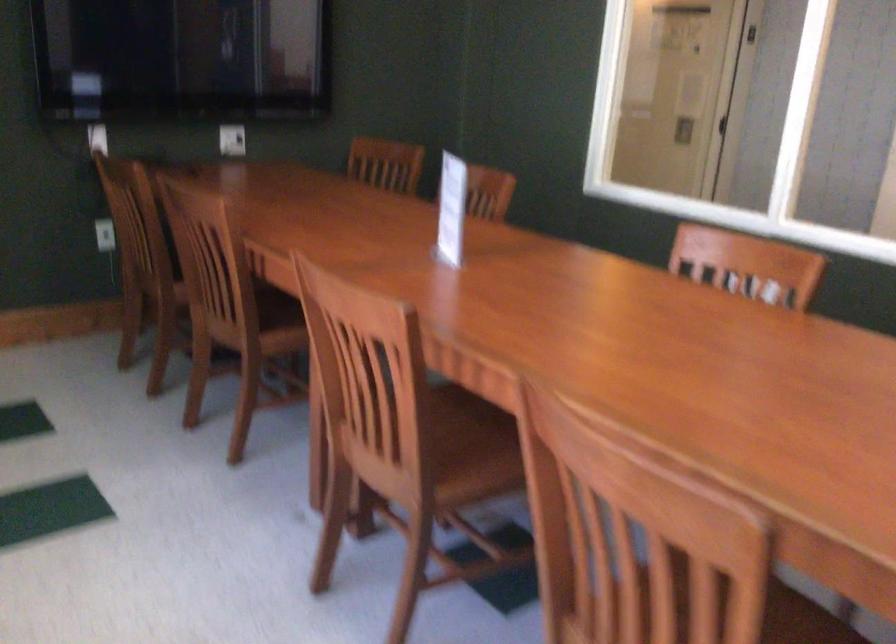
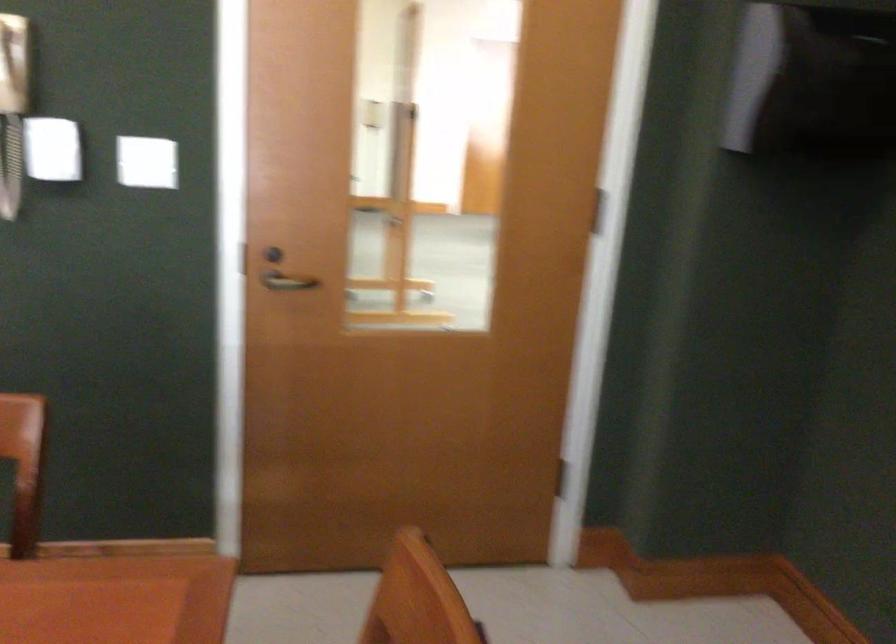
Question: Based on the continuous images, in which direction is the camera rotating? Reply with the corresponding letter.

Choices:
 (A) Left
 (B) Right
 (C) Up
 (D) Down

Answer: (B)